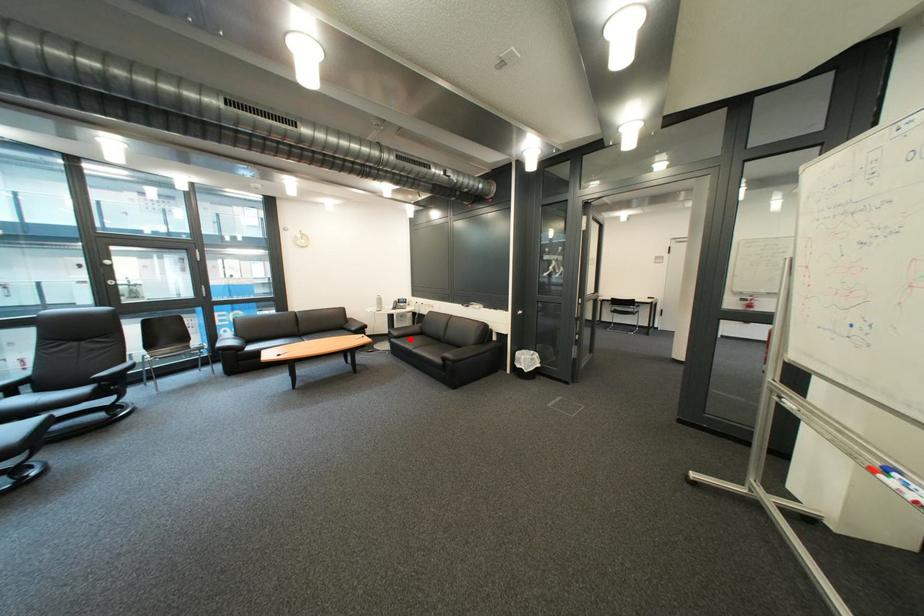
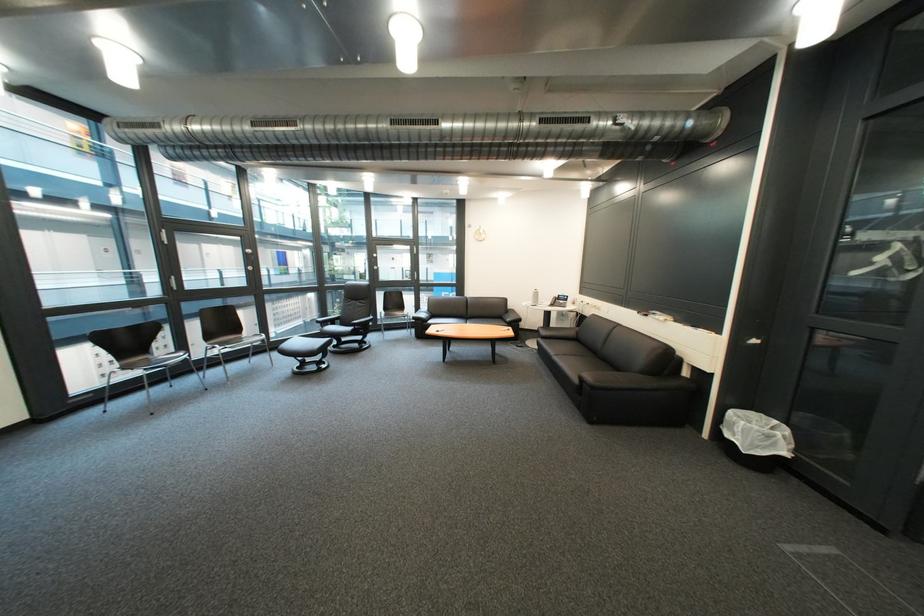
Question: A red point is marked in image1. In image2, is the corresponding 3D point closer to the camera or farther? Reply with the corresponding letter.

Choices:
 (A) The corresponding 3D point is closer.
 (B) The corresponding 3D point is farther.

Answer: (A)